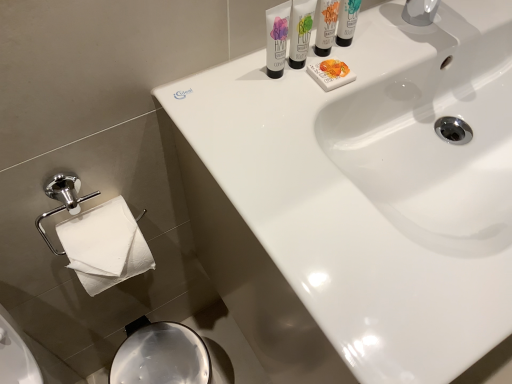
Locate an element on the screen. free space to the left of white glossy tube at upper center, arranged as the third shaving cream when viewed from the right is located at coordinates [x=207, y=92].